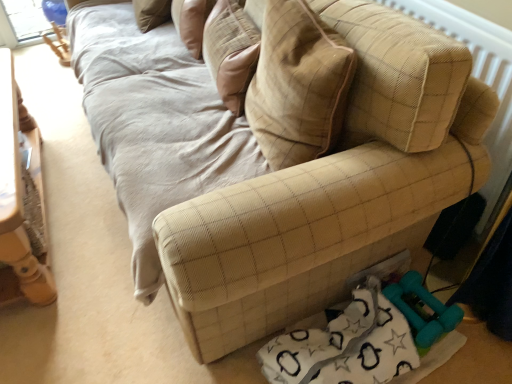
You are a GUI agent. You are given a task and a screenshot of the screen. Output one action in this format:
    pyautogui.click(x=<x>, y=<y>)
    Task: Click on the blank space situated above beige fabric radiator at upper right (from a real-world perspective)
    Image resolution: width=512 pixels, height=384 pixels.
    Given the screenshot: What is the action you would take?
    pyautogui.click(x=461, y=18)